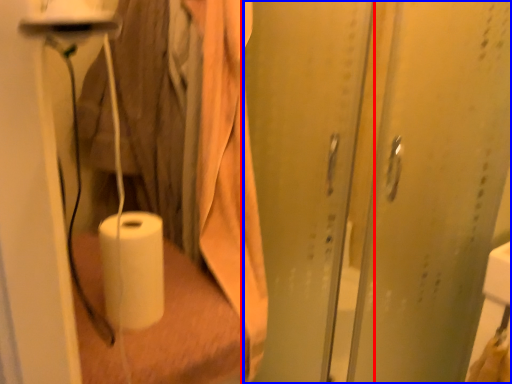
Question: Among these objects, which one is farthest to the camera, screen door (highlighted by a red box) or screen door (highlighted by a blue box)?

Choices:
 (A) screen door
 (B) screen door

Answer: (B)